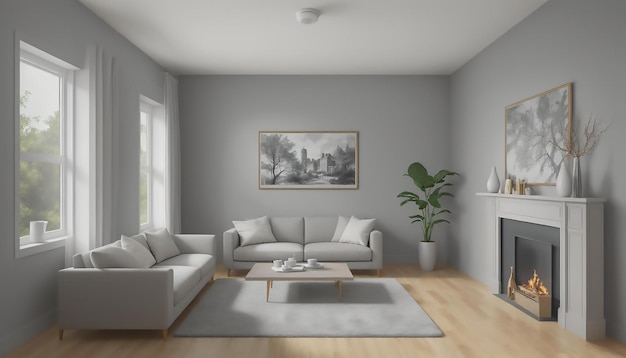
You are a GUI agent. You are given a task and a screenshot of the screen. Output one action in this format:
    pyautogui.click(x=<x>, y=<y>)
    Task: Click on the livingroom
    The image size is (626, 358).
    Given the screenshot: What is the action you would take?
    pyautogui.click(x=424, y=147)